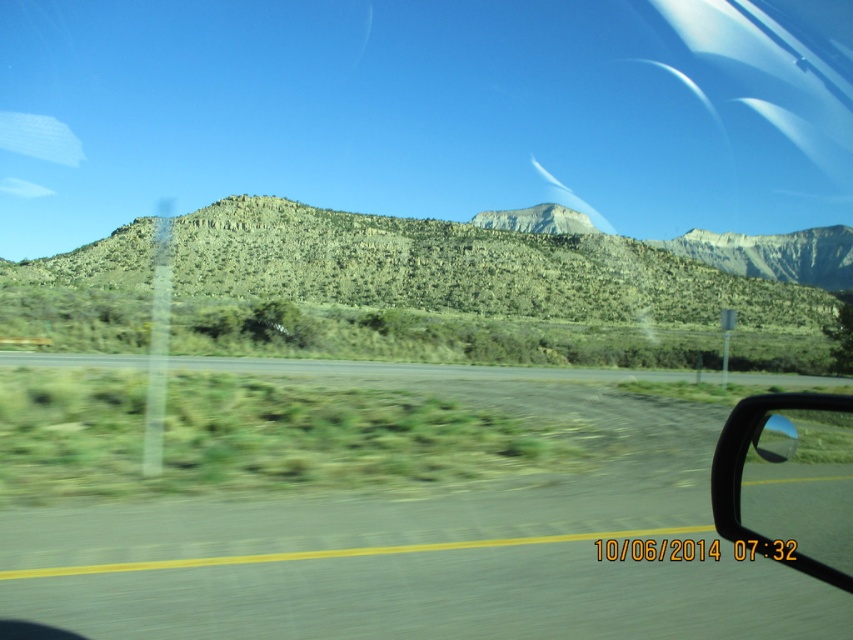
Question: Observing the image, what is the correct spatial positioning of black rubber view mirror at lower right in reference to green grassy highway at center?

Choices:
 (A) right
 (B) left

Answer: (A)

Question: Which object is the farthest from the black rubber view mirror at lower right?

Choices:
 (A) green textured hill at center
 (B) green grassy highway at center

Answer: (A)

Question: Which of the following is the closest to the observer?

Choices:
 (A) green textured hill at center
 (B) green grassy highway at center
 (C) black rubber view mirror at lower right

Answer: (C)

Question: In this image, where is black rubber view mirror at lower right located relative to green grassy highway at center?

Choices:
 (A) below
 (B) above

Answer: (B)

Question: Is green textured hill at center below green grassy highway at center?

Choices:
 (A) no
 (B) yes

Answer: (A)

Question: Which of these objects is positioned farthest from the black rubber view mirror at lower right?

Choices:
 (A) green grassy highway at center
 (B) green textured hill at center

Answer: (B)